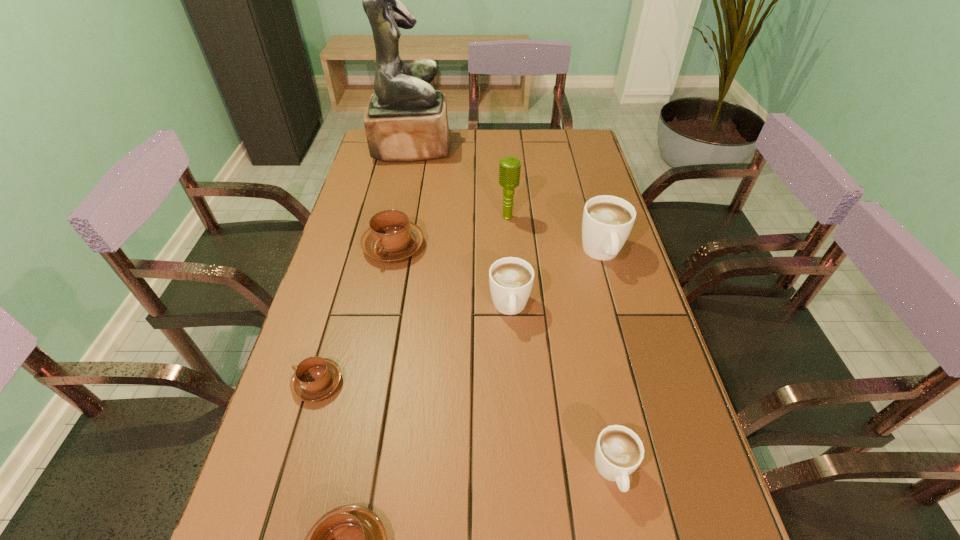
Locate which brown cappuccino ranks second in proximity to the third cappuccino from right to left. Please provide its 2D coordinates. Your answer should be formatted as a tuple, i.e. [(x, y)], where the tuple contains the x and y coordinates of a point satisfying the conditions above.

[(315, 378)]